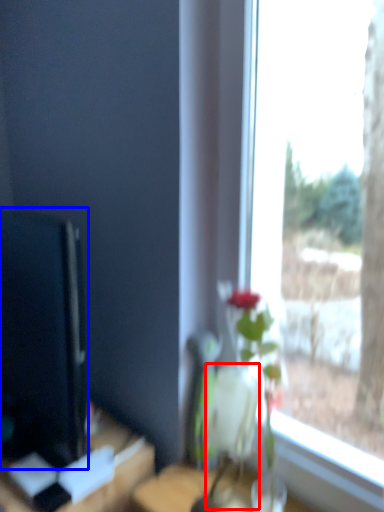
Question: Which object appears closest to the camera in this image, vase (highlighted by a red box) or computer monitor (highlighted by a blue box)?

Choices:
 (A) vase
 (B) computer monitor

Answer: (B)